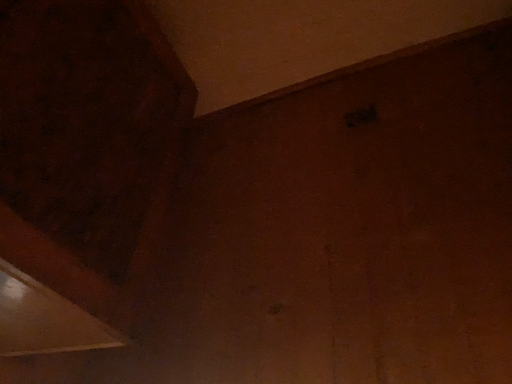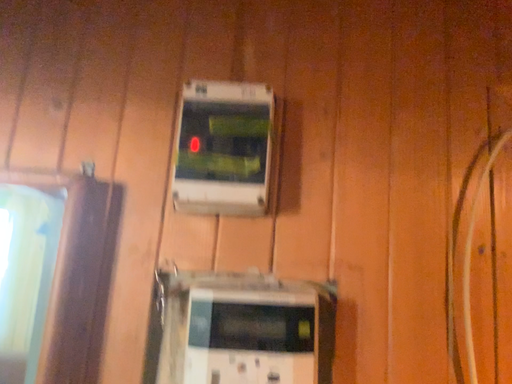
Question: Which way did the camera rotate in the video?

Choices:
 (A) rotated left
 (B) rotated right

Answer: (B)